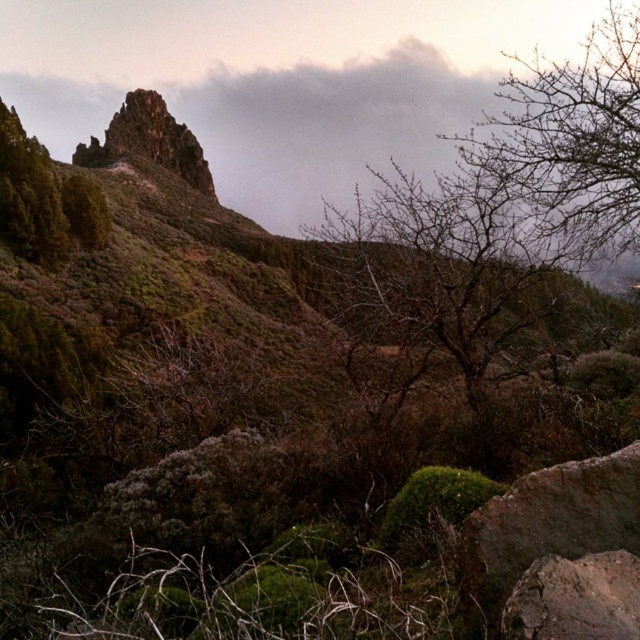
Question: Which object is positioned farthest from the rusty metallic rock at lower right?

Choices:
 (A) rusty rock at lower right
 (B) bare branches at upper right

Answer: (B)

Question: Which point appears closest to the camera in this image?

Choices:
 (A) (605, 243)
 (B) (20, 189)

Answer: (A)

Question: Can you confirm if bare branches at upper right is bigger than rusty rock at lower right?

Choices:
 (A) yes
 (B) no

Answer: (A)

Question: Can you confirm if bare branches at upper right is smaller than rusty rock at lower right?

Choices:
 (A) yes
 (B) no

Answer: (B)

Question: Estimate the real-world distances between objects in this image. Which object is closer to the rusty metallic rock at lower right?

Choices:
 (A) green matte rock at upper left
 (B) bare branches at upper right

Answer: (B)

Question: Is bare branches at upper right further to camera compared to rusty metallic rock at lower right?

Choices:
 (A) yes
 (B) no

Answer: (A)